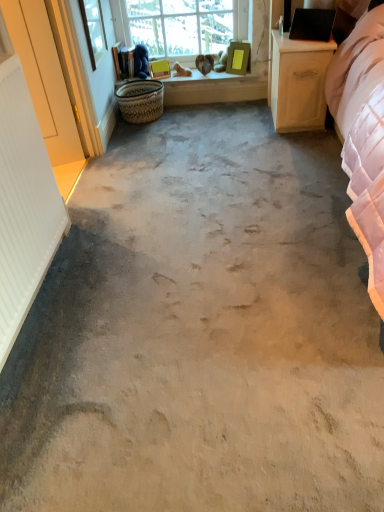
Where is `vacant area to the right of woven natural basket at center`? This screenshot has width=384, height=512. vacant area to the right of woven natural basket at center is located at coordinates (185, 116).